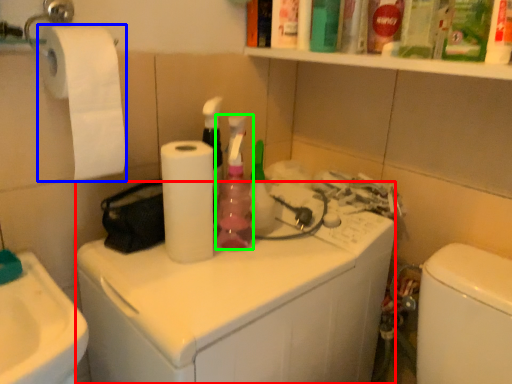
Question: Which object is positioned closest to washing machine (highlighted by a red box)? Select from toilet paper (highlighted by a blue box) and cleaning product (highlighted by a green box).

Choices:
 (A) toilet paper
 (B) cleaning product

Answer: (B)